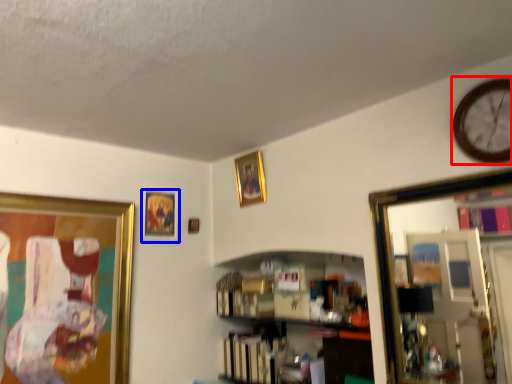
Question: Which object is further to the camera taking this photo, clock (highlighted by a red box) or picture frame (highlighted by a blue box)?

Choices:
 (A) clock
 (B) picture frame

Answer: (B)